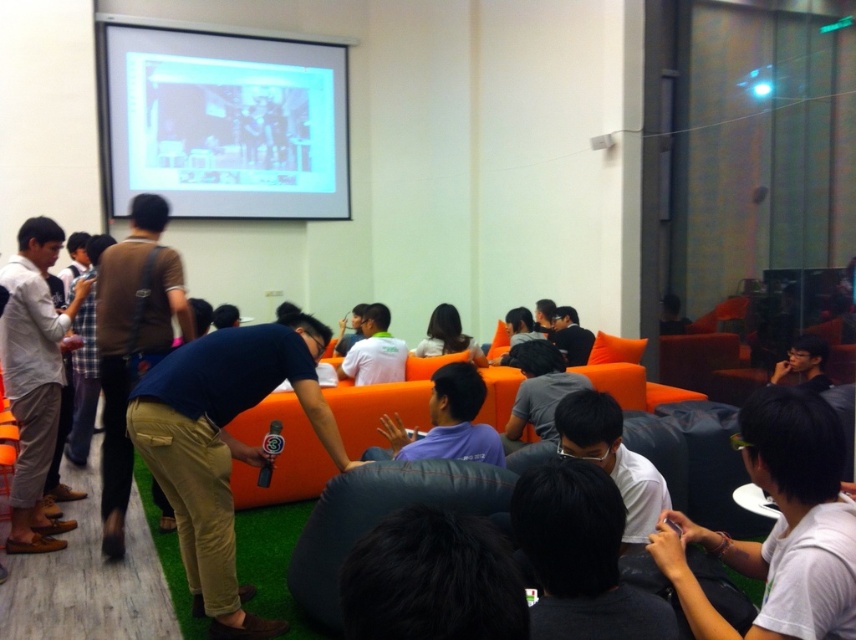
The height and width of the screenshot is (640, 856). What do you see at coordinates (132, 342) in the screenshot? I see `brown fabric shirt at center` at bounding box center [132, 342].

Is brown fabric shirt at center bigger than white shirt at center?

Yes.

Does point (155, 259) come closer to viewer compared to point (372, 342)?

Yes.

The image size is (856, 640). I want to click on brown fabric shirt at center, so click(x=132, y=342).

Does blue cotton shirt at center have a larger size compared to blue fabric shirt at center?

Yes, blue cotton shirt at center is bigger than blue fabric shirt at center.

Which is below, blue cotton shirt at center or blue fabric shirt at center?

blue cotton shirt at center

Describe the element at coordinates (223, 445) in the screenshot. I see `blue cotton shirt at center` at that location.

Identify the location of blue cotton shirt at center. This screenshot has width=856, height=640. (223, 445).

Who is shorter, dark gray shirt at center or white shirt at center?

Standing shorter between the two is dark gray shirt at center.

Is dark gray shirt at center smaller than white shirt at center?

Correct, dark gray shirt at center occupies less space than white shirt at center.

Does point (536, 349) lie behind point (348, 376)?

No, it is in front of (348, 376).

At what (x,y) coordinates should I click in order to perform the action: click on dark gray shirt at center. Please return your answer as a coordinate pair (x, y). Looking at the image, I should click on (538, 390).